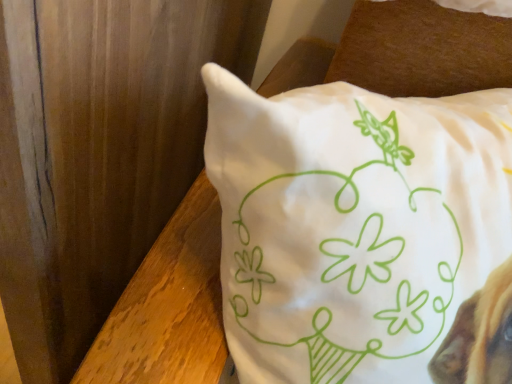
Image resolution: width=512 pixels, height=384 pixels. What do you see at coordinates (353, 224) in the screenshot? I see `white fabric pillow at upper right` at bounding box center [353, 224].

In order to click on white fabric pillow at upper right in this screenshot , I will do `click(353, 224)`.

I want to click on white fabric pillow at upper right, so click(x=353, y=224).